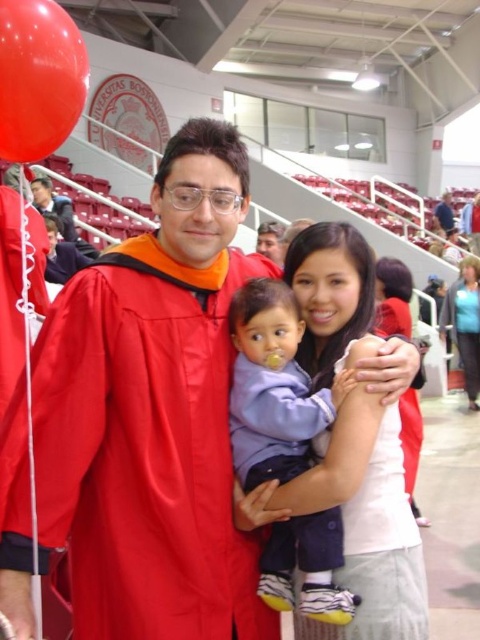
You are attending a graduation ceremony at Boston University and notice a rubber balloon at upper left and a white fabric shirt at upper center. Which object is positioned lower in the image?

The rubber balloon at upper left has a lesser height compared to the white fabric shirt at upper center, so the rubber balloon at upper left is positioned lower.

You are attending a graduation ceremony at Boston University and notice two people in the foreground. One is wearing a white matte dress at center and the other a blue fabric shirt at upper right. Based on their positions in the image, which person is closer to the front of the stage?

The white matte dress at center is located below the blue fabric shirt at upper right, meaning the person in the white matte dress at center is closer to the front of the stage since they are positioned lower in the image.

Based on the photo, you are a photographer trying to capture the perfect shot of the graduation ceremony. You notice a point at coordinates (393, 298) in the image. Based on the scene description, what object or part of an object is located at this point?

The point at coordinates (393, 298) is located on the white matte dress at center.